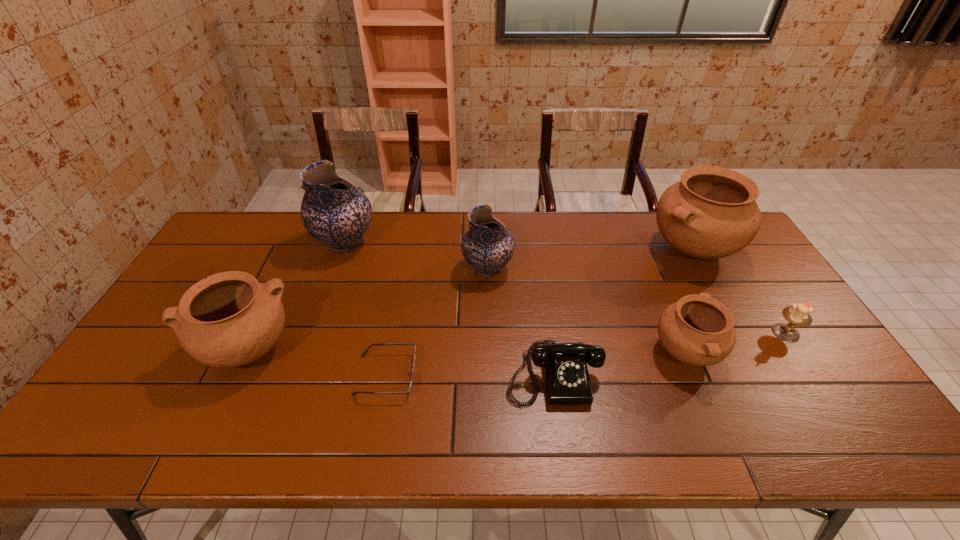
You are a GUI agent. You are given a task and a screenshot of the screen. Output one action in this format:
    pyautogui.click(x=<x>, y=<y>)
    Task: Click on the pottery that is the second closest to the shortest pottery
    Image resolution: width=960 pixels, height=540 pixels.
    Given the screenshot: What is the action you would take?
    pyautogui.click(x=488, y=245)

Identify which terracotta pottery is located as the nearest to the bigger blue pottery. Please provide its 2D coordinates. Your answer should be formatted as a tuple, i.e. [(x, y)], where the tuple contains the x and y coordinates of a point satisfying the conditions above.

[(229, 319)]

You are a GUI agent. You are given a task and a screenshot of the screen. Output one action in this format:
    pyautogui.click(x=<x>, y=<y>)
    Task: Click on the terracotta pottery object that ranks as the second closest to the shortest object
    
    Given the screenshot: What is the action you would take?
    pyautogui.click(x=697, y=330)

Find the location of a particular element. blank space that satisfies the following two spatial constraints: 1. on the back side of the biggest terracotta pottery; 2. on the right side of the third pottery from right to left is located at coordinates (487, 248).

Locate an element on the screen. vacant space that satisfies the following two spatial constraints: 1. on the dial of the telephone; 2. on the front-facing side of the spectacles is located at coordinates (553, 375).